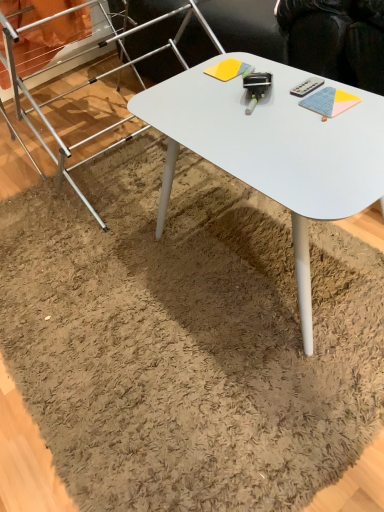
Image resolution: width=384 pixels, height=512 pixels. I want to click on vacant space to the right of yellow matte notepad at center, which ranks as the second notepad in front-to-back order, so (267, 66).